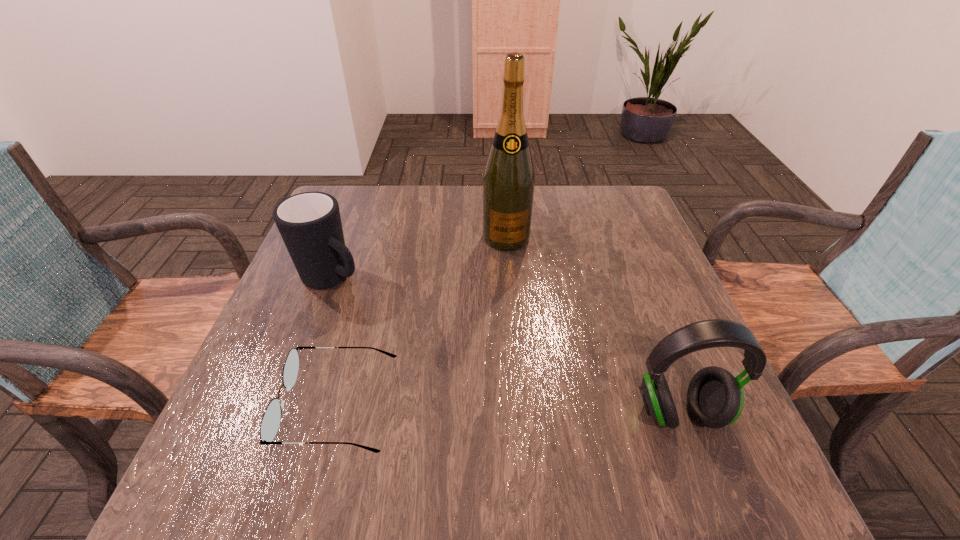
You are a GUI agent. You are given a task and a screenshot of the screen. Output one action in this format:
    pyautogui.click(x=<x>, y=<y>)
    Task: Click on the free space on the desktop that is between the spectacles and the headset and is positioned on the front-facing side of the farthest object
    
    Given the screenshot: What is the action you would take?
    pyautogui.click(x=527, y=409)

This screenshot has height=540, width=960. I want to click on vacant space on the desktop that is between the shortest object and the headset and is positioned on the side of the second farthest object with the handle, so click(528, 409).